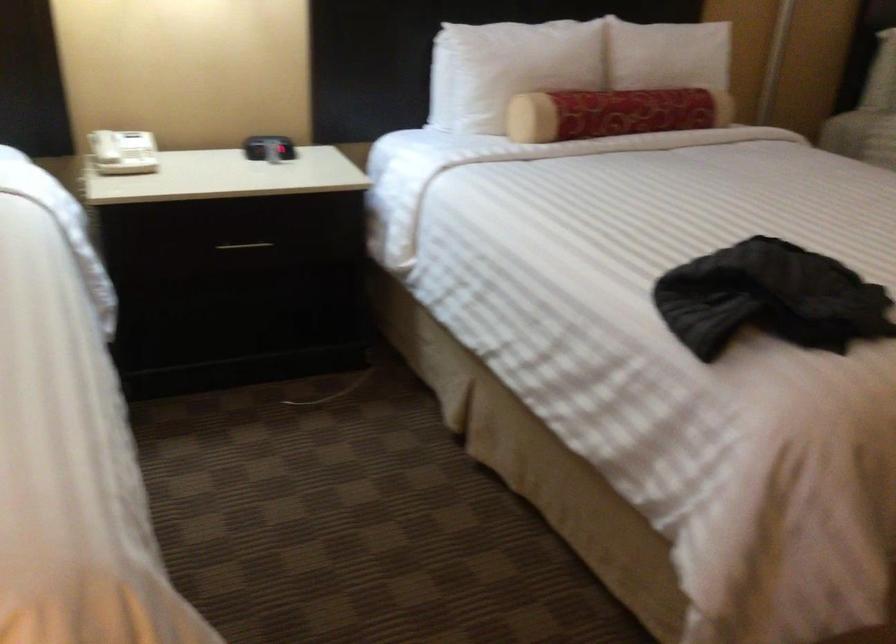
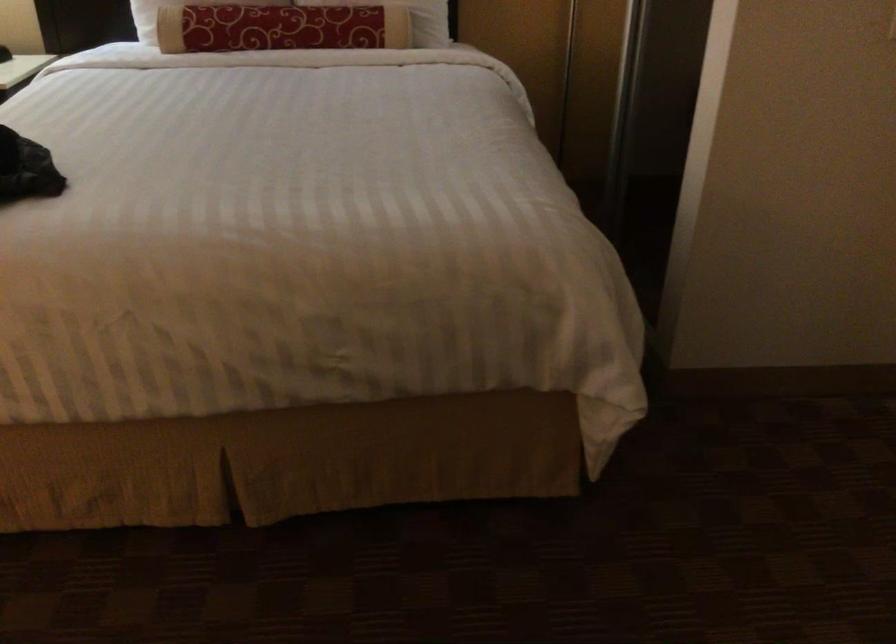
Where in the second image is the point corresponding to point (666, 93) from the first image?

(311, 15)